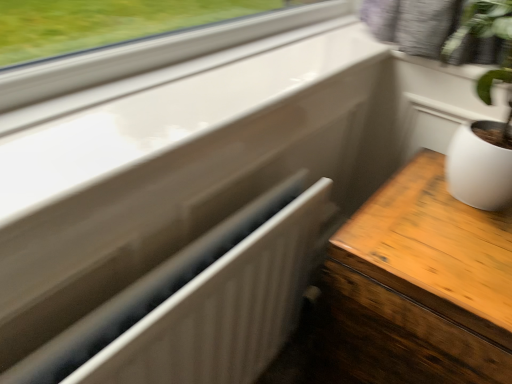
At what (x,y) coordinates should I click in order to perform the action: click on free location above wooden table at right (from a real-world perspective). Please return your answer as a coordinate pair (x, y). This screenshot has width=512, height=384. Looking at the image, I should click on (446, 238).